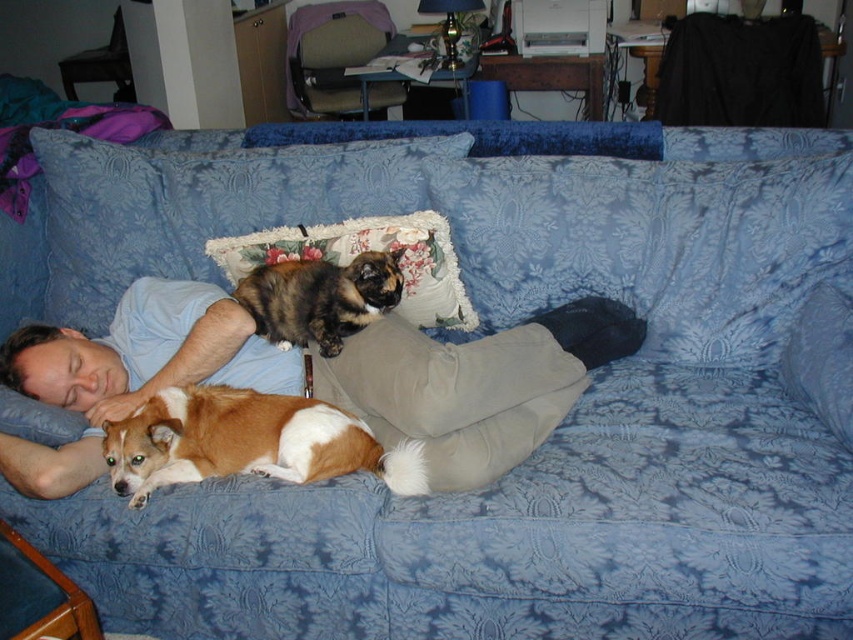
Consider the image. Does light blue cotton shirt at center have a lesser height compared to brown and white fur at center?

Answer: In fact, light blue cotton shirt at center may be taller than brown and white fur at center.

Is light blue cotton shirt at center above brown and white fur at center?

No, light blue cotton shirt at center is not above brown and white fur at center.

The height and width of the screenshot is (640, 853). Describe the element at coordinates (474, 385) in the screenshot. I see `light blue cotton shirt at center` at that location.

Image resolution: width=853 pixels, height=640 pixels. I want to click on light blue cotton shirt at center, so click(x=474, y=385).

Is point (231, 426) less distant than point (252, 291)?

Yes, point (231, 426) is in front of point (252, 291).

Is brown and white fur at lower left wider than brown and white fur at center?

Correct, the width of brown and white fur at lower left exceeds that of brown and white fur at center.

Is point (393, 477) farther from camera compared to point (306, 296)?

No, it is in front of (306, 296).

Find the location of `brown and white fur at lower left`. brown and white fur at lower left is located at coordinates [247, 442].

Who is taller, brown and white fur at lower left or floral fabric pillow at center?

floral fabric pillow at center is taller.

Is brown and white fur at lower left thinner than floral fabric pillow at center?

A: Yes, brown and white fur at lower left is thinner than floral fabric pillow at center.

Is point (300, 464) farther from viewer compared to point (235, 266)?

No, (300, 464) is in front of (235, 266).

Identify the location of brown and white fur at lower left. (247, 442).